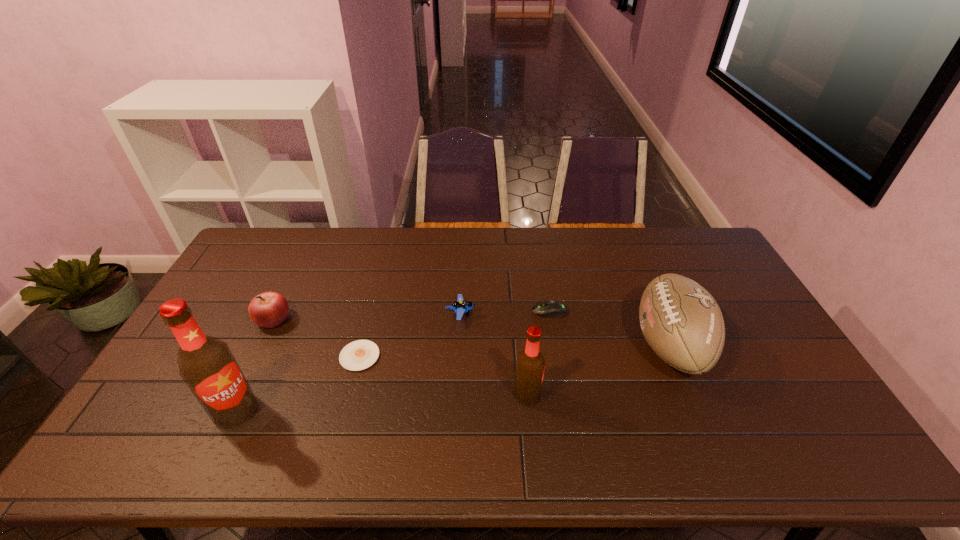
Choose which object is the second nearest neighbor to the tallest object. Please provide its 2D coordinates. Your answer should be formatted as a tuple, i.e. [(x, y)], where the tuple contains the x and y coordinates of a point satisfying the conditions above.

[(269, 309)]

This screenshot has height=540, width=960. Identify the location of free space in the image that satisfies the following two spatial constraints: 1. on the laces of the rightmost object; 2. on the front side of the fifth object from right to left. (675, 356).

Find the location of a particular element. This screenshot has height=540, width=960. free point that satisfies the following two spatial constraints: 1. on the wheel side of the second shortest object; 2. on the front side of the shorter beer bottle is located at coordinates click(x=564, y=395).

At what (x,y) coordinates should I click in order to perform the action: click on vacant region that satisfies the following two spatial constraints: 1. on the laces of the rightmost object; 2. on the front side of the egg yolk. Please return your answer as a coordinate pair (x, y). This screenshot has height=540, width=960. Looking at the image, I should click on (675, 356).